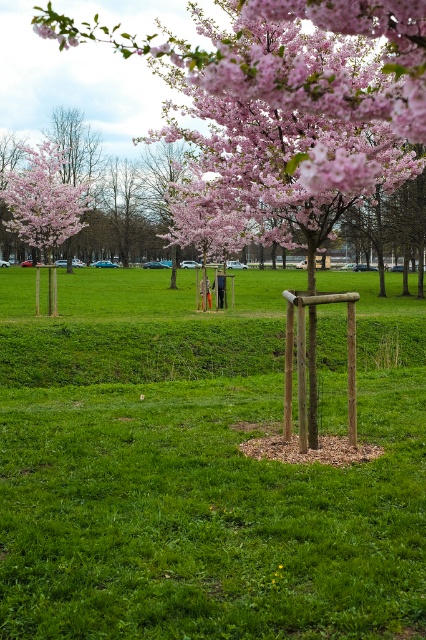
Can you confirm if matte pink blossoms at upper left is shorter than pink matte flower at upper center?

No.

In the scene shown: Between matte pink blossoms at upper left and pink matte flower at upper center, which one appears on the right side from the viewer's perspective?

pink matte flower at upper center is more to the right.

Who is more forward, [85,198] or [39,28]?

Point [39,28] is in front.

Identify the location of matte pink blossoms at upper left. (43, 198).

Is pink blossom tree at upper center below matte pink blossoms at upper left?

Correct, pink blossom tree at upper center is located below matte pink blossoms at upper left.

Is pink blossom tree at upper center to the left of matte pink blossoms at upper left from the viewer's perspective?

Incorrect, pink blossom tree at upper center is not on the left side of matte pink blossoms at upper left.

Is point (376, 163) closer to viewer compared to point (20, 186)?

That is True.

Find the location of a particular element. This screenshot has height=640, width=426. pink blossom tree at upper center is located at coordinates (316, 76).

Does pink blossom tree at upper center have a lesser height compared to pink matte flower at upper center?

In fact, pink blossom tree at upper center may be taller than pink matte flower at upper center.

Which is more to the left, pink blossom tree at upper center or pink matte flower at upper center?

Positioned to the left is pink matte flower at upper center.

Is point (314, 104) more distant than point (46, 24)?

No.

Identify the location of pink blossom tree at upper center. (316, 76).